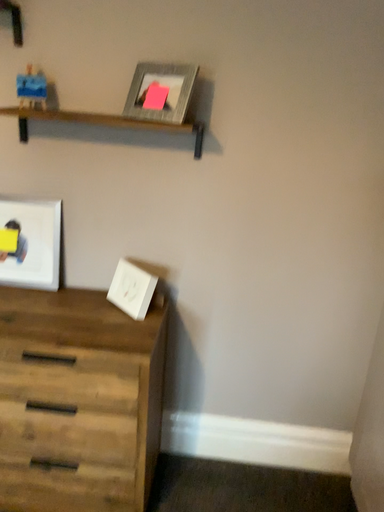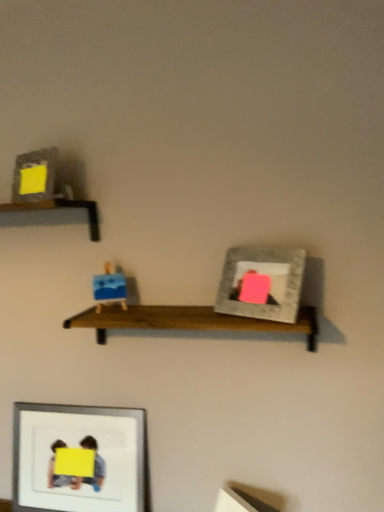
Question: How did the camera likely rotate when shooting the video?

Choices:
 (A) rotated downward
 (B) rotated upward

Answer: (B)